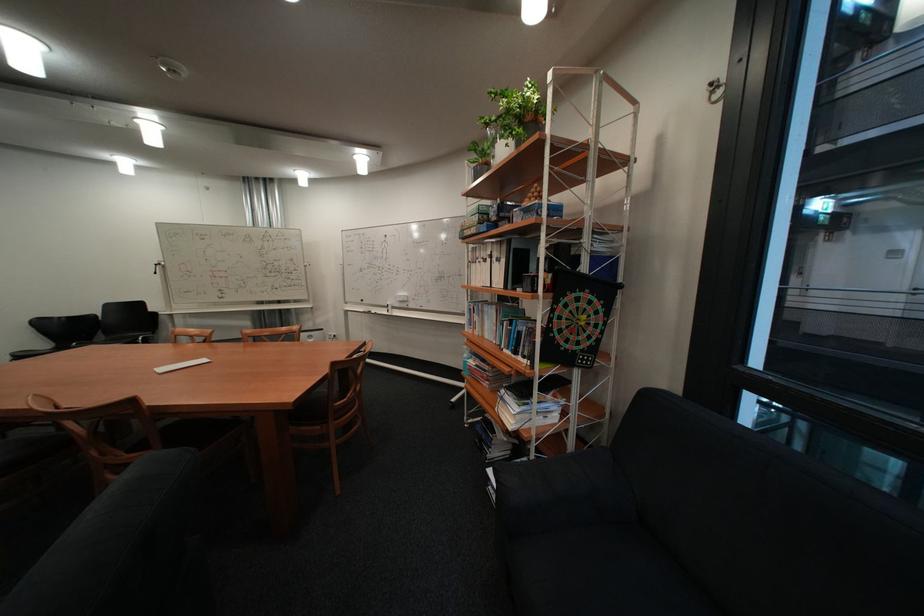
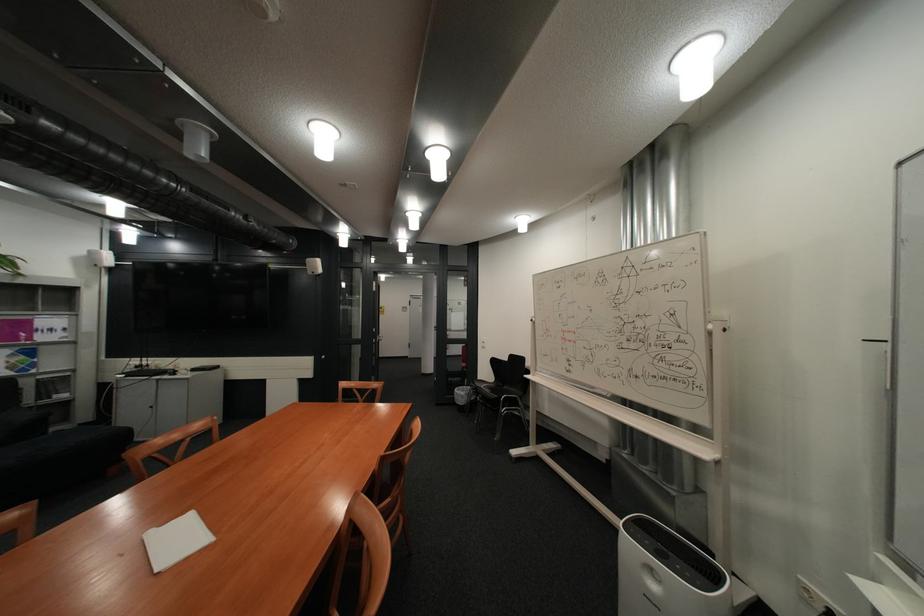
Find the pixel in the second image that matches pixel 336 330 in the first image.

(728, 576)